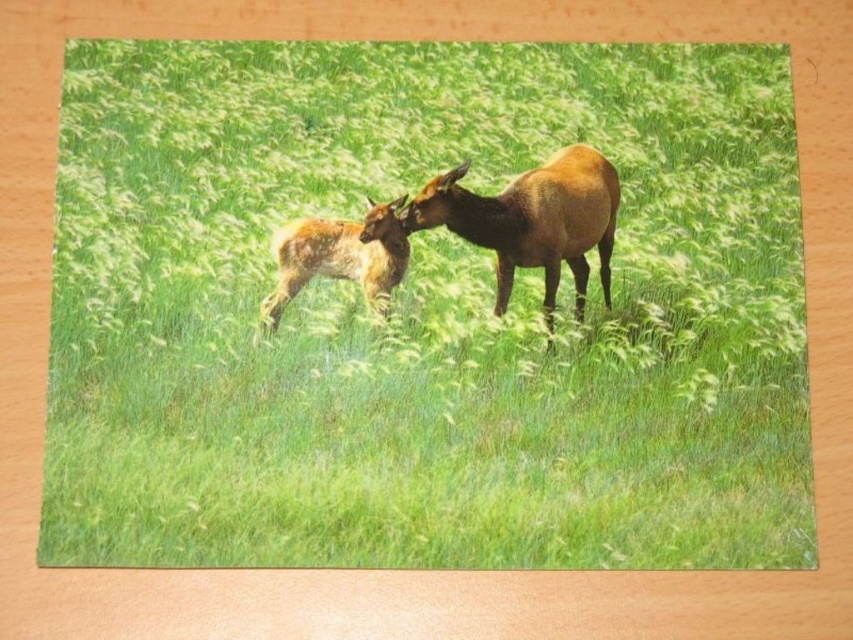
Question: Which point is farther from the camera taking this photo?

Choices:
 (A) (303, 260)
 (B) (511, 236)

Answer: (B)

Question: Observing the image, what is the correct spatial positioning of brown glossy deer at center in reference to spotted fur deer at center?

Choices:
 (A) below
 (B) above

Answer: (B)

Question: Is brown glossy deer at center in front of spotted fur deer at center?

Choices:
 (A) no
 (B) yes

Answer: (A)

Question: Is brown glossy deer at center to the left of spotted fur deer at center from the viewer's perspective?

Choices:
 (A) no
 (B) yes

Answer: (A)